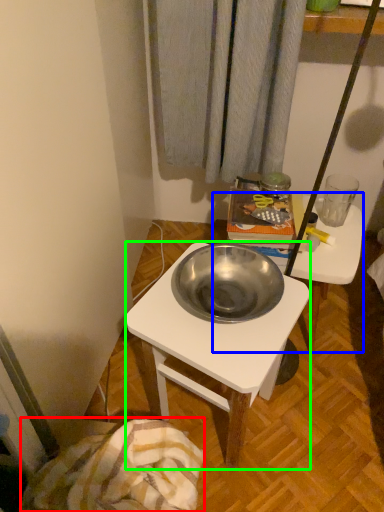
Question: Which object is the farthest from blanket (highlighted by a red box)? Choose among these: table (highlighted by a blue box) or desk (highlighted by a green box).

Choices:
 (A) table
 (B) desk

Answer: (A)